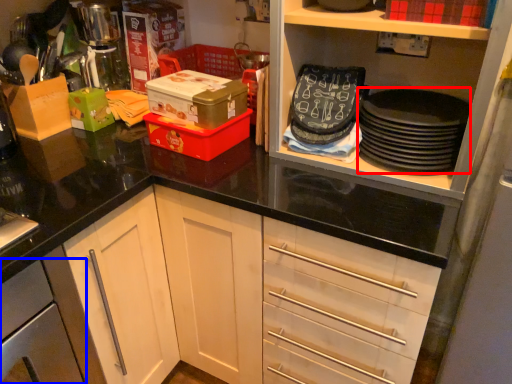
Question: Which object is closer to the camera taking this photo, appliance (highlighted by a red box) or cabinetry (highlighted by a blue box)?

Choices:
 (A) appliance
 (B) cabinetry

Answer: (B)